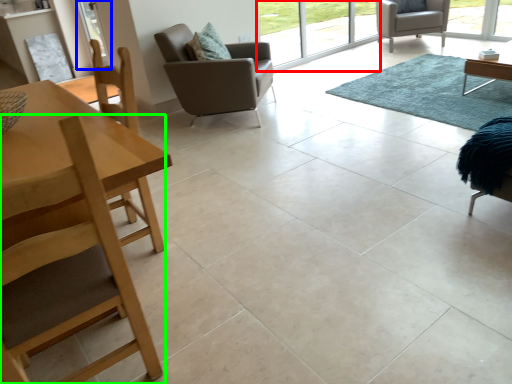
Question: Which is nearer to the window screen (highlighted by a red box)? screen door (highlighted by a blue box) or chair (highlighted by a green box).

Choices:
 (A) screen door
 (B) chair

Answer: (A)